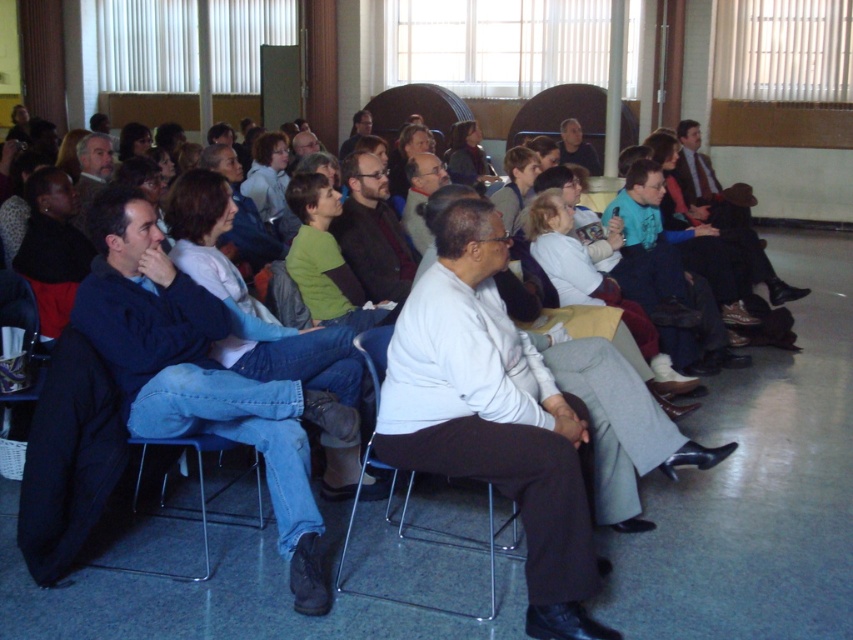
Is dark suit at center above light green sweater at center?

Indeed, dark suit at center is positioned over light green sweater at center.

Can you confirm if dark suit at center is bigger than light green sweater at center?

Correct, dark suit at center is larger in size than light green sweater at center.

Between point (788, 292) and point (277, 179), which one is positioned behind?

The point (277, 179) is more distant.

Locate an element on the screen. This screenshot has height=640, width=853. dark suit at center is located at coordinates click(x=724, y=211).

Who is more forward, (352, 509) or (143, 451)?

Point (352, 509) is in front.

Is metallic silver chair at center taller than blue fabric chair at lower left?

Correct, metallic silver chair at center is much taller as blue fabric chair at lower left.

Image resolution: width=853 pixels, height=640 pixels. Find the location of `metallic silver chair at center`. metallic silver chair at center is located at coordinates (431, 538).

Where is `metallic silver chair at center`? This screenshot has height=640, width=853. metallic silver chair at center is located at coordinates (431, 538).

Who is more distant from viewer, [155,273] or [370,160]?

Positioned behind is point [370,160].

Which is more to the right, dark blue jeans at left or dark brown leather jacket at center?

Positioned to the right is dark brown leather jacket at center.

What do you see at coordinates (202, 374) in the screenshot? I see `dark blue jeans at left` at bounding box center [202, 374].

You are a GUI agent. You are given a task and a screenshot of the screen. Output one action in this format:
    pyautogui.click(x=<x>, y=<y>)
    Task: Click on the dark blue jeans at left
    The height and width of the screenshot is (640, 853).
    Given the screenshot: What is the action you would take?
    pyautogui.click(x=202, y=374)